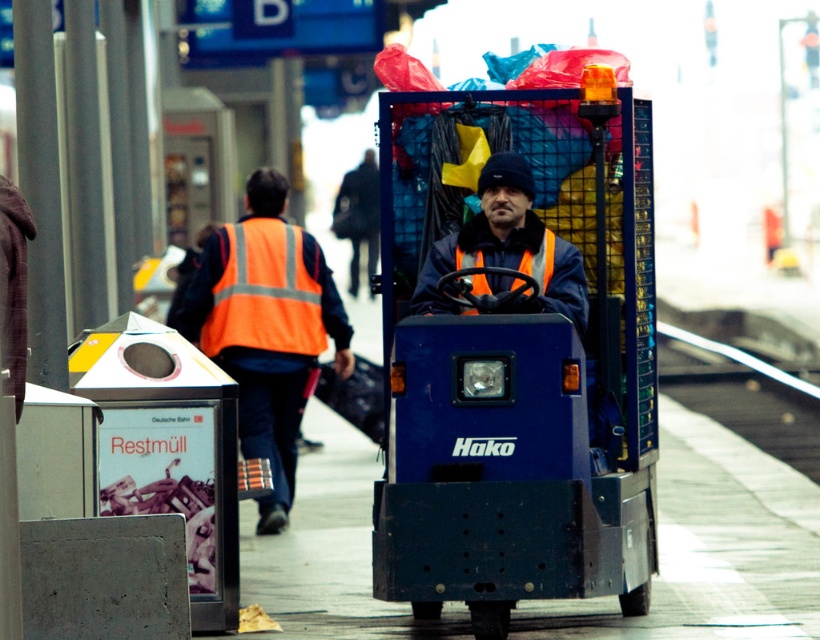
Based on the photo, you are a safety inspector at the train station platform. You notice the orange reflective vest at center and the metal at center. According to safety regulations, the reflective vest must be placed to the right of the metal object to ensure visibility. Is the current placement compliant with the regulations?

The orange reflective vest at center is to the left of metal at center, so the current placement does not comply with the safety regulations requiring the vest to be to the right of the metal object for visibility.